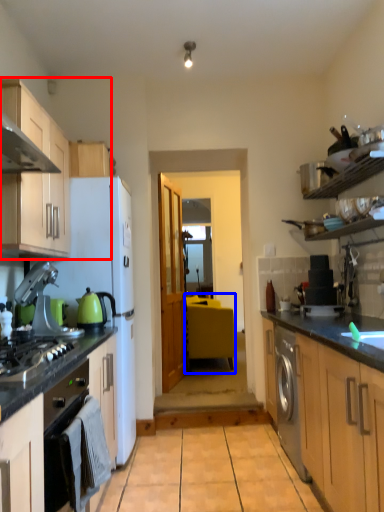
Question: Which point is further to the camera, cabinetry (highlighted by a red box) or table (highlighted by a blue box)?

Choices:
 (A) cabinetry
 (B) table

Answer: (B)